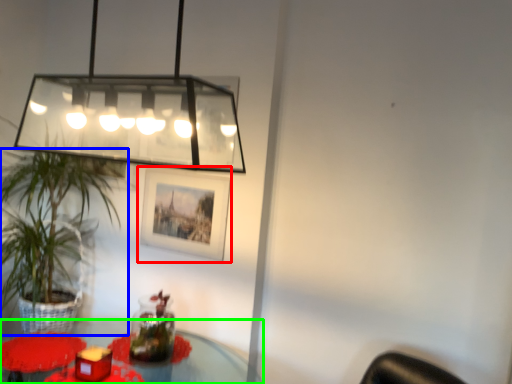
Question: Which object is the closest to the picture frame (highlighted by a red box)? Choose among these: houseplant (highlighted by a blue box) or table (highlighted by a green box).

Choices:
 (A) houseplant
 (B) table

Answer: (A)